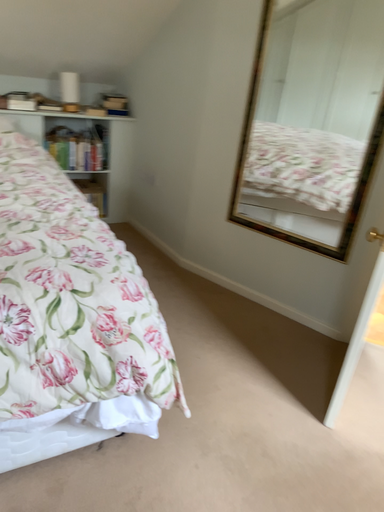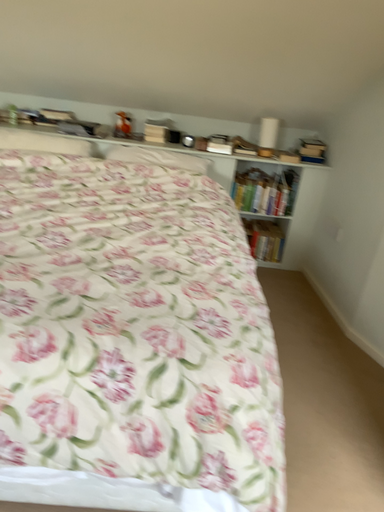
Question: How did the camera likely rotate when shooting the video?

Choices:
 (A) rotated left
 (B) rotated right

Answer: (A)